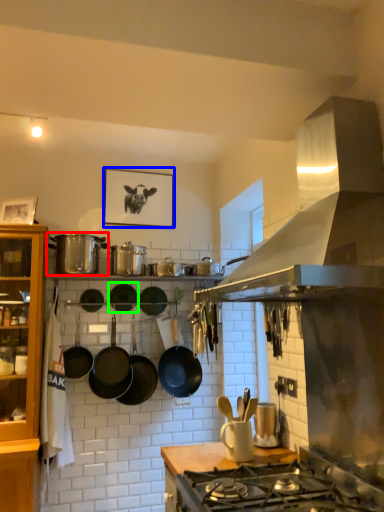
Question: Considering the real-world distances, which object is closest to pot/pan (highlighted by a red box)? picture frame (highlighted by a blue box) or wok (highlighted by a green box).

Choices:
 (A) picture frame
 (B) wok

Answer: (B)